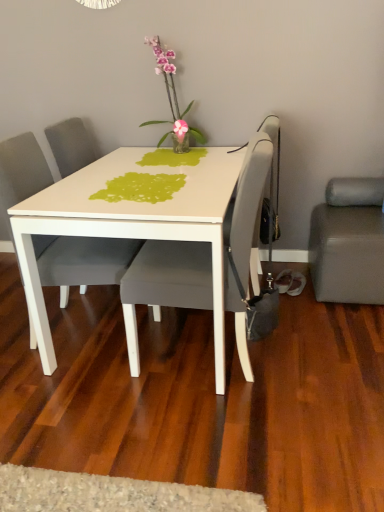
The height and width of the screenshot is (512, 384). What are the coordinates of `blank space to the left of translucent glass vase at upper center` in the screenshot? It's located at (125, 151).